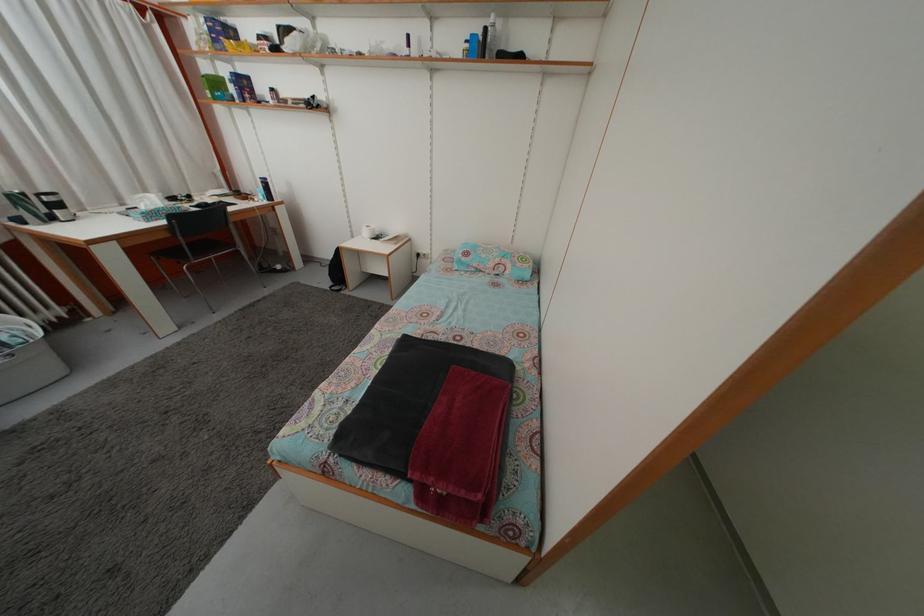
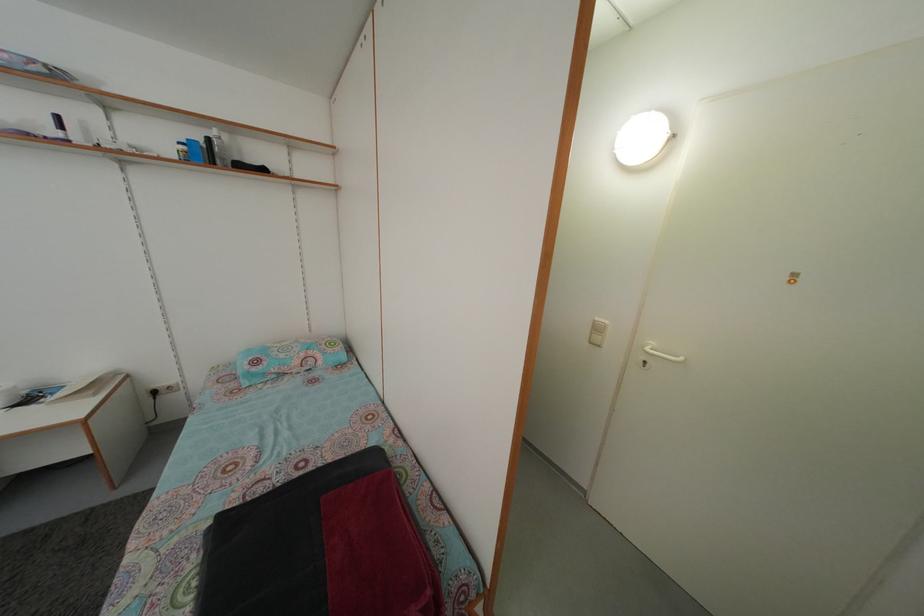
Locate, in the second image, the point that corresponds to point 492,38 in the first image.

(214, 148)